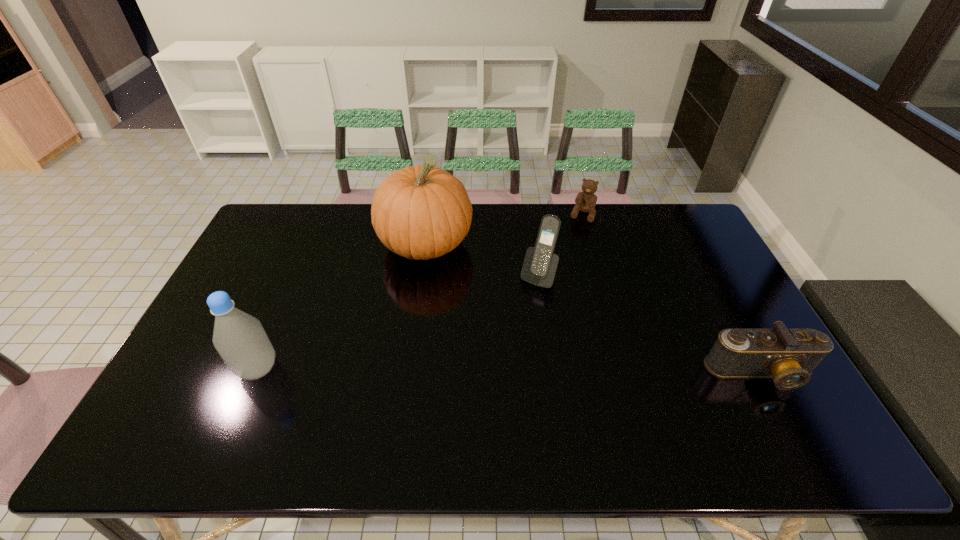
Identify the location of bottle that is at the near edge. Image resolution: width=960 pixels, height=540 pixels. (240, 339).

Locate an element on the screen. camera that is at the near edge is located at coordinates (788, 356).

Find the location of a particular element. object that is at the left edge is located at coordinates coord(240,339).

I want to click on object situated at the right edge, so click(788, 356).

This screenshot has width=960, height=540. I want to click on object present at the near left corner, so click(x=240, y=339).

Find the location of `object present at the near right corner`. object present at the near right corner is located at coordinates (788, 356).

The image size is (960, 540). Find the location of `blank area at the far edge`. blank area at the far edge is located at coordinates (589, 227).

You are a GUI agent. You are given a task and a screenshot of the screen. Output one action in this format:
    pyautogui.click(x=<x>, y=<y>)
    Task: Click on the blank area at the near edge
    This screenshot has height=540, width=960.
    Given the screenshot: What is the action you would take?
    point(567,385)

At what (x,y) coordinates should I click in order to perform the action: click on vacant space at the left edge of the desktop. Please return your answer as a coordinate pair (x, y). Looking at the image, I should click on (241, 291).

The width and height of the screenshot is (960, 540). I want to click on vacant space at the right edge of the desktop, so click(669, 249).